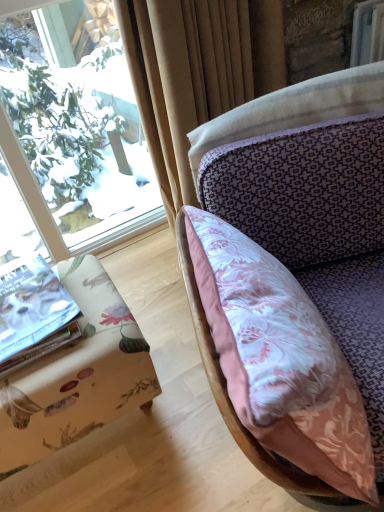
Identify the location of free spot to the right of white paper book at lower left. This screenshot has width=384, height=512. tap(96, 310).